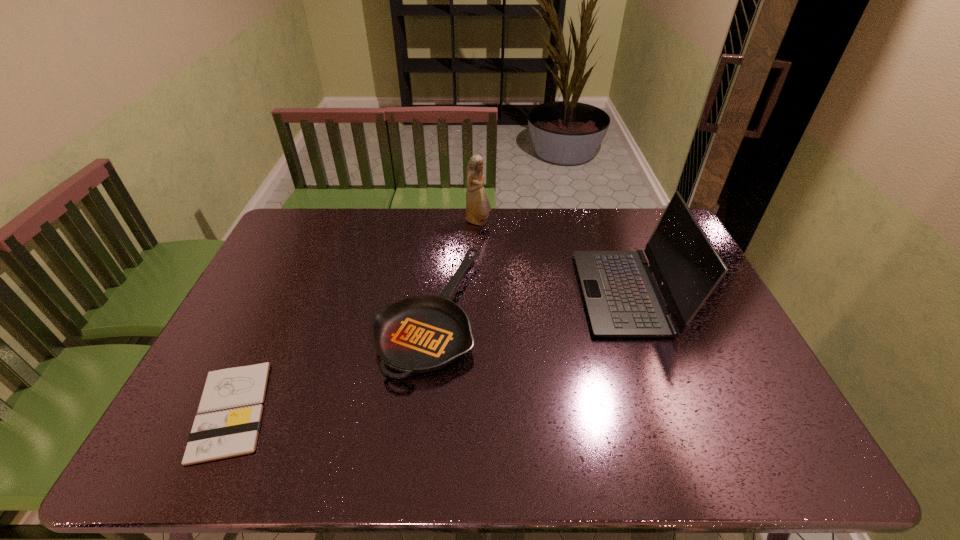
In the image, there is a desktop. Identify the location of free space at the far right corner. This screenshot has height=540, width=960. (649, 212).

Locate an element on the screen. The width and height of the screenshot is (960, 540). free spot between the figurine and the shortest object is located at coordinates (354, 316).

You are a GUI agent. You are given a task and a screenshot of the screen. Output one action in this format:
    pyautogui.click(x=<x>, y=<y>)
    Task: Click on the vacant area that lies between the third tallest object and the farthest object
    This screenshot has width=960, height=540.
    Given the screenshot: What is the action you would take?
    pyautogui.click(x=453, y=267)

Locate an element on the screen. vacant area that lies between the frying pan and the figurine is located at coordinates (453, 267).

Find the location of a particular element. free space between the farthest object and the frying pan is located at coordinates (453, 267).

Locate an element on the screen. free space between the shortest object and the figurine is located at coordinates (354, 316).

Where is `empty space between the farthest object and the rightmost object`? empty space between the farthest object and the rightmost object is located at coordinates (553, 258).

This screenshot has height=540, width=960. Find the location of `vacant space in between the second shortest object and the shortest object`. vacant space in between the second shortest object and the shortest object is located at coordinates (330, 362).

I want to click on unoccupied area between the leftmost object and the farthest object, so click(x=354, y=316).

Identify the location of empty space that is in between the figurine and the leftmost object. (354, 316).